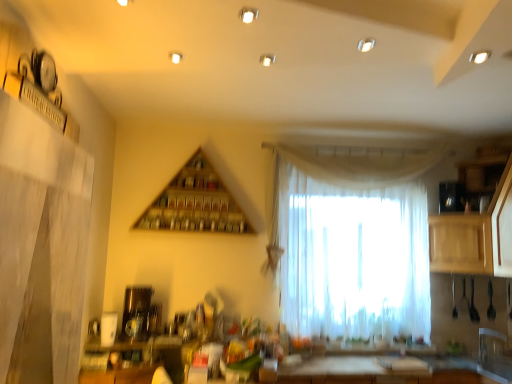
Question: Does light wood cabinet at right, which is counted as the 1th cabinetry, starting from the front, come behind wooden cabinet at right, arranged as the 1th cabinetry when viewed from the back?

Choices:
 (A) no
 (B) yes

Answer: (A)

Question: From a real-world perspective, is light wood cabinet at right, which is counted as the 1th cabinetry, starting from the front, positioned under wooden cabinet at right, which is the second cabinetry in front-to-back order, based on gravity?

Choices:
 (A) no
 (B) yes

Answer: (A)

Question: Is light wood cabinet at right, the 2th cabinetry in the back-to-front sequence, outside of wooden cabinet at right, which is the second cabinetry in front-to-back order?

Choices:
 (A) no
 (B) yes

Answer: (B)

Question: Is light wood cabinet at right, the 2th cabinetry in the back-to-front sequence, to the left of wooden cabinet at right, arranged as the 1th cabinetry when viewed from the back, from the viewer's perspective?

Choices:
 (A) no
 (B) yes

Answer: (A)

Question: Is light wood cabinet at right, the 2th cabinetry in the back-to-front sequence, beside wooden cabinet at right, which is the second cabinetry in front-to-back order?

Choices:
 (A) yes
 (B) no

Answer: (A)

Question: Is light wood cabinet at right, which is counted as the 1th cabinetry, starting from the front, positioned beyond the bounds of wooden triangle at upper center?

Choices:
 (A) no
 (B) yes

Answer: (B)

Question: Is light wood cabinet at right, which is counted as the 1th cabinetry, starting from the front, thinner than wooden triangle at upper center?

Choices:
 (A) yes
 (B) no

Answer: (B)

Question: Does light wood cabinet at right, the 2th cabinetry in the back-to-front sequence, touch wooden triangle at upper center?

Choices:
 (A) yes
 (B) no

Answer: (B)

Question: Is light wood cabinet at right, which is counted as the 1th cabinetry, starting from the front, closer to camera compared to wooden triangle at upper center?

Choices:
 (A) no
 (B) yes

Answer: (B)

Question: From the image's perspective, is light wood cabinet at right, which is counted as the 1th cabinetry, starting from the front, on top of wooden triangle at upper center?

Choices:
 (A) no
 (B) yes

Answer: (A)

Question: Considering the relative positions of light wood cabinet at right, which is counted as the 1th cabinetry, starting from the front, and wooden triangle at upper center in the image provided, is light wood cabinet at right, which is counted as the 1th cabinetry, starting from the front, to the right of wooden triangle at upper center from the viewer's perspective?

Choices:
 (A) no
 (B) yes

Answer: (B)

Question: From a real-world perspective, is wooden triangle at upper center physically above light wood cabinet at right, the 2th cabinetry in the back-to-front sequence?

Choices:
 (A) yes
 (B) no

Answer: (A)